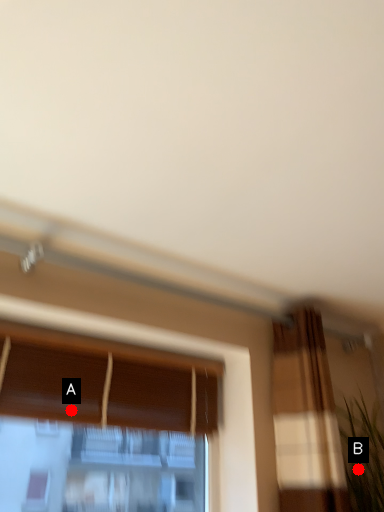
Question: Two points are circled on the image, labeled by A and B beside each circle. Which point is closer to the camera?

Choices:
 (A) A is closer
 (B) B is closer

Answer: (A)